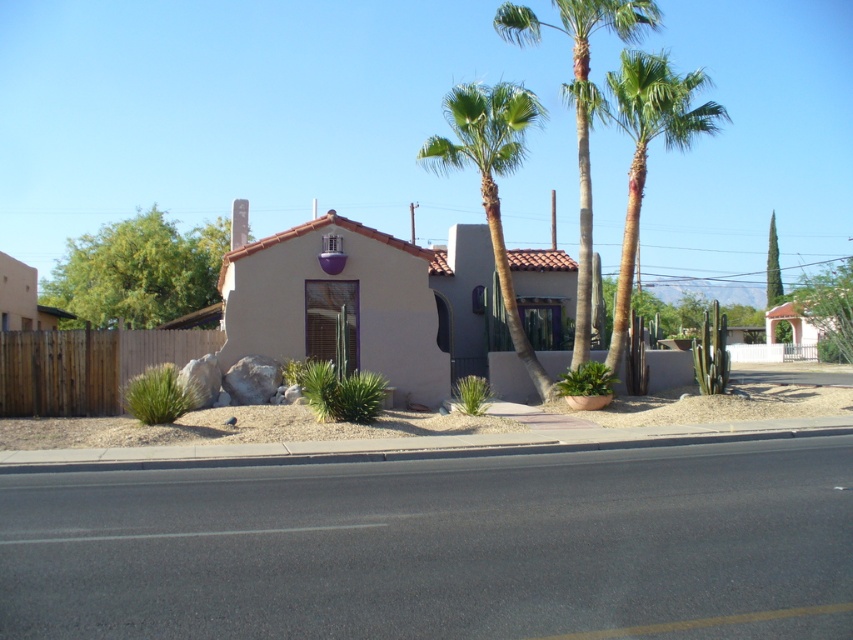
Which is behind, point (143, 346) or point (460, 112)?

The point (460, 112) is more distant.

Measure the distance between brown wooden fence at left and camera.

brown wooden fence at left is 18.64 meters away from camera.

Where is `brown wooden fence at left`? brown wooden fence at left is located at coordinates (86, 365).

Who is higher up, green leafy palm tree at upper right or green leafy tree at upper right?

green leafy palm tree at upper right is above.

Is point (663, 140) less distant than point (770, 252)?

No, it is behind (770, 252).

Which is in front, point (700, 81) or point (770, 221)?

Point (700, 81) is in front.

Find the location of a particular element. This screenshot has width=853, height=640. green leafy palm tree at upper right is located at coordinates [x=647, y=145].

Does brown wooden fence at left have a greater height compared to green leafy tree at upper right?

Incorrect, brown wooden fence at left's height is not larger of green leafy tree at upper right's.

Does brown wooden fence at left have a lesser height compared to green leafy tree at upper right?

Yes, brown wooden fence at left is shorter than green leafy tree at upper right.

Where is `brown wooden fence at left`? brown wooden fence at left is located at coordinates (86, 365).